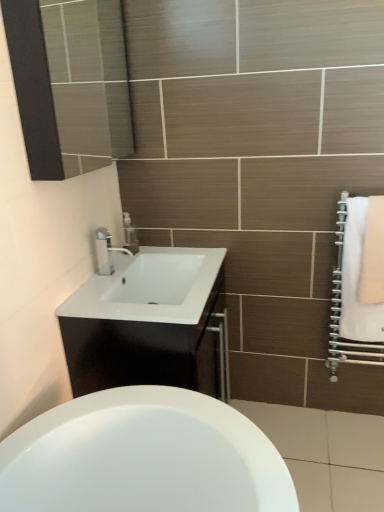
At what (x,y) coordinates should I click in order to perform the action: click on vacant space to the right of clear plastic soap dispenser at upper center. Please return your answer as a coordinate pair (x, y). The image size is (384, 512). Looking at the image, I should click on (155, 254).